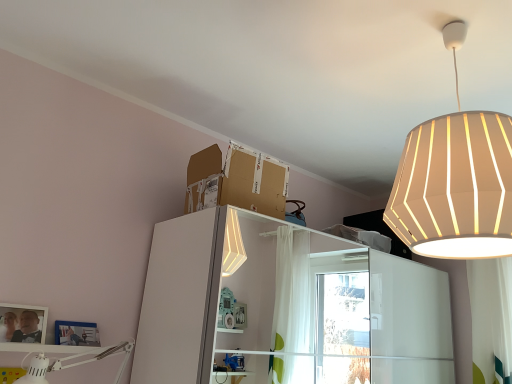
Question: Is brown cardboard box at upper center thinner than white fabric curtain at right?

Choices:
 (A) yes
 (B) no

Answer: (B)

Question: Is white fabric curtain at right completely or partially inside brown cardboard box at upper center?

Choices:
 (A) no
 (B) yes

Answer: (A)

Question: Is brown cardboard box at upper center located outside white fabric curtain at right?

Choices:
 (A) no
 (B) yes

Answer: (B)

Question: From the image's perspective, is brown cardboard box at upper center under white fabric curtain at right?

Choices:
 (A) no
 (B) yes

Answer: (A)

Question: Does brown cardboard box at upper center have a smaller size compared to white fabric curtain at right?

Choices:
 (A) yes
 (B) no

Answer: (B)

Question: Can you confirm if brown cardboard box at upper center is positioned to the left of white fabric curtain at right?

Choices:
 (A) yes
 (B) no

Answer: (A)

Question: Is brown cardboard box at upper center in front of white fabric lampshade at upper right, positioned as the first lamp in top-to-bottom order?

Choices:
 (A) yes
 (B) no

Answer: (B)

Question: Is brown cardboard box at upper center far from white fabric lampshade at upper right, placed as the 1th lamp when sorted from right to left?

Choices:
 (A) no
 (B) yes

Answer: (A)

Question: Would you say white fabric lampshade at upper right, placed as the 1th lamp when sorted from right to left, is part of brown cardboard box at upper center's contents?

Choices:
 (A) yes
 (B) no

Answer: (B)

Question: Is brown cardboard box at upper center looking in the opposite direction of white fabric lampshade at upper right, placed as the second lamp when sorted from bottom to top?

Choices:
 (A) yes
 (B) no

Answer: (B)

Question: Is brown cardboard box at upper center next to white fabric lampshade at upper right, placed as the second lamp when sorted from bottom to top, and touching it?

Choices:
 (A) no
 (B) yes

Answer: (A)

Question: Considering the relative sizes of brown cardboard box at upper center and white fabric lampshade at upper right, placed as the second lamp when sorted from bottom to top, in the image provided, is brown cardboard box at upper center taller than white fabric lampshade at upper right, placed as the second lamp when sorted from bottom to top,?

Choices:
 (A) yes
 (B) no

Answer: (B)

Question: Considering the relative positions of white fabric lampshade at upper right, placed as the second lamp when sorted from bottom to top, and matte silver picture frame at lower left in the image provided, is white fabric lampshade at upper right, placed as the second lamp when sorted from bottom to top, behind matte silver picture frame at lower left?

Choices:
 (A) yes
 (B) no

Answer: (B)